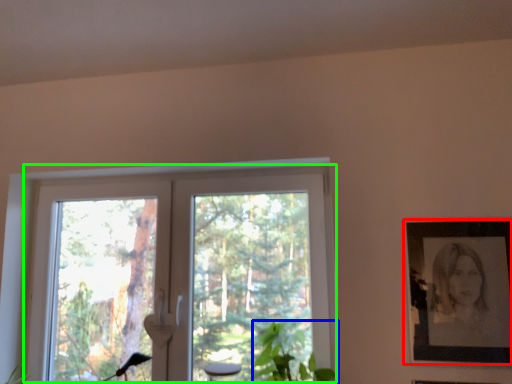
Question: Estimate the real-world distances between objects in this image. Which object is farther from picture frame (highlighted by a red box), plant (highlighted by a blue box) or window (highlighted by a green box)?

Choices:
 (A) plant
 (B) window

Answer: (B)